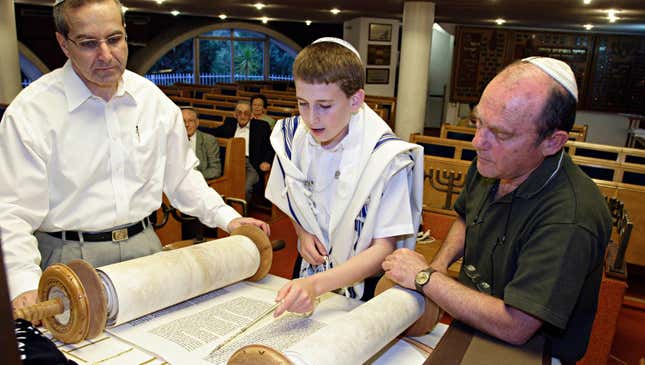
At what (x,y) coordinates should I click in order to perform the action: click on window. Please return your answer as a coordinate pair (x, y). This screenshot has width=645, height=365. Looking at the image, I should click on (235, 57).